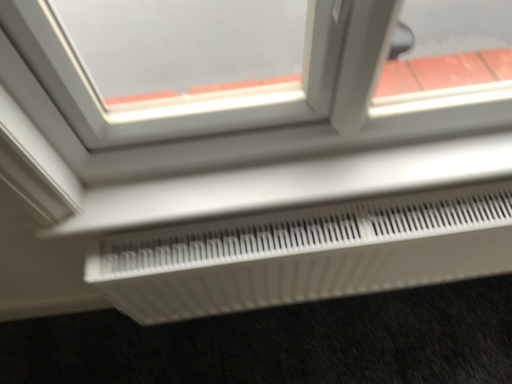
Question: In terms of height, does white plastic radiator at lower center look taller or shorter compared to white plastic radiator at lower center?

Choices:
 (A) short
 (B) tall

Answer: (A)

Question: From a real-world perspective, is white plastic radiator at lower center positioned above or below white plastic radiator at lower center?

Choices:
 (A) below
 (B) above

Answer: (B)

Question: Would you say white plastic radiator at lower center is to the left or to the right of white plastic radiator at lower center in the picture?

Choices:
 (A) right
 (B) left

Answer: (B)

Question: Which is correct: white plastic radiator at lower center is inside white plastic radiator at lower center, or outside of it?

Choices:
 (A) inside
 (B) outside

Answer: (B)

Question: Considering the positions of white plastic radiator at lower center and white plastic radiator at lower center in the image, is white plastic radiator at lower center wider or thinner than white plastic radiator at lower center?

Choices:
 (A) wide
 (B) thin

Answer: (B)

Question: From a real-world perspective, is white plastic radiator at lower center positioned above or below white plastic radiator at lower center?

Choices:
 (A) above
 (B) below

Answer: (B)

Question: Is white plastic radiator at lower center taller or shorter than white plastic radiator at lower center?

Choices:
 (A) tall
 (B) short

Answer: (A)